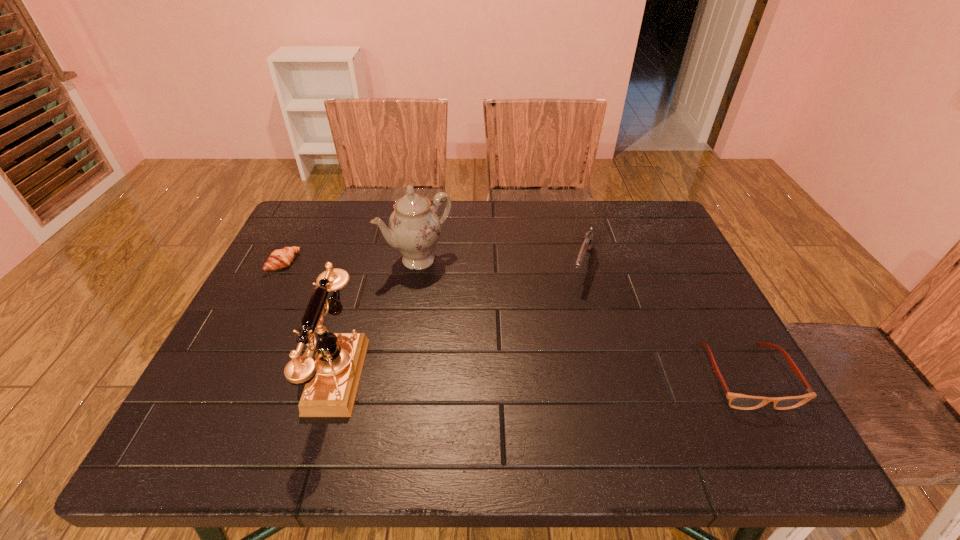
I want to click on vacant spot on the desktop that is between the telephone and the spectacles and is positioned on the spout of the chinaware, so click(532, 375).

What are the coordinates of `free space on the desktop that is between the telephone and the spectacles and is positioned on the front-facing side of the pastry` in the screenshot? It's located at (492, 375).

Locate an element on the screen. The width and height of the screenshot is (960, 540). free space on the desktop that is between the telephone and the rightmost object and is positioned aiming along the barrel of the fourth object from left to right is located at coordinates (542, 375).